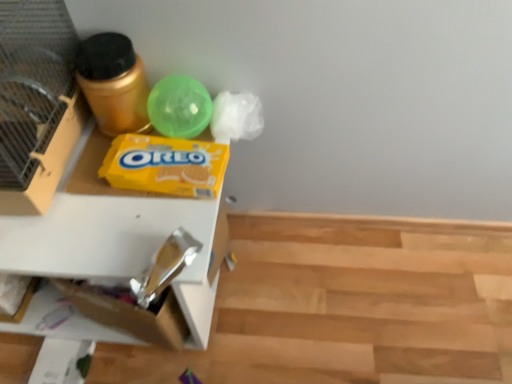
Identify the location of wooden floor at lower right. (345, 305).

The image size is (512, 384). In order to click on brushed metal bird cage at left in this screenshot , I will do `click(36, 102)`.

Does point (135, 212) lie in front of point (6, 0)?

No, it is not.

From the image's perspective, is white cardboard drawer at left over brushed metal bird cage at left?

No.

How distant is white cardboard drawer at left from brushed metal bird cage at left?

white cardboard drawer at left is 6.67 inches away from brushed metal bird cage at left.

Considering the relative sizes of white cardboard drawer at left and brushed metal bird cage at left in the image provided, is white cardboard drawer at left wider than brushed metal bird cage at left?

Yes.

Which object is further away from the camera taking this photo, gold metallic canister at upper left or white cardboard drawer at left?

gold metallic canister at upper left is more distant.

Does gold metallic canister at upper left have a greater height compared to white cardboard drawer at left?

In fact, gold metallic canister at upper left may be shorter than white cardboard drawer at left.

Is there a large distance between gold metallic canister at upper left and white cardboard drawer at left?

No.

The width and height of the screenshot is (512, 384). What are the coordinates of `table on the left of gold metallic canister at upper left` in the screenshot? It's located at (121, 244).

Is gold metallic canister at upper left looking in the opposite direction of brushed metal bird cage at left?

No, gold metallic canister at upper left is not facing away from brushed metal bird cage at left.

Based on the photo, considering the relative sizes of gold metallic canister at upper left and brushed metal bird cage at left in the image provided, is gold metallic canister at upper left wider than brushed metal bird cage at left?

No, gold metallic canister at upper left is not wider than brushed metal bird cage at left.

Based on the photo, can you confirm if gold metallic canister at upper left is positioned to the right of brushed metal bird cage at left?

Indeed, gold metallic canister at upper left is positioned on the right side of brushed metal bird cage at left.

In the scene shown: Considering the relative sizes of translucent green ball at upper center and wooden floor at lower right in the image provided, is translucent green ball at upper center shorter than wooden floor at lower right?

No, translucent green ball at upper center is not shorter than wooden floor at lower right.

Who is more distant, translucent green ball at upper center or wooden floor at lower right?

wooden floor at lower right.

Does translucent green ball at upper center turn towards wooden floor at lower right?

No, translucent green ball at upper center is not facing towards wooden floor at lower right.

Choose the correct answer: Is translucent green ball at upper center inside wooden floor at lower right or outside it?

translucent green ball at upper center lies outside wooden floor at lower right.

In the scene shown: Which of these two, yellow cardboard oreo box at center or brushed metal bird cage at left, stands shorter?

With less height is yellow cardboard oreo box at center.

Does yellow cardboard oreo box at center come behind brushed metal bird cage at left?

Yes, yellow cardboard oreo box at center is further from the camera.

Is yellow cardboard oreo box at center bigger than brushed metal bird cage at left?

No.

From the image's perspective, between wooden floor at lower right and translucent green ball at upper center, who is located below?

wooden floor at lower right, from the image's perspective.

Does point (302, 340) lie behind point (200, 88)?

Yes, it is behind point (200, 88).

Is brushed metal bird cage at left far away from wooden floor at lower right?

That's not correct — brushed metal bird cage at left is a little close to wooden floor at lower right.

From a real-world perspective, which object rests below the other?

wooden floor at lower right.

Looking at this image, from the image's perspective, is brushed metal bird cage at left above or below wooden floor at lower right?

From the image's perspective, brushed metal bird cage at left appears above wooden floor at lower right.

What's the angular difference between brushed metal bird cage at left and wooden floor at lower right's facing directions?

The angular difference between brushed metal bird cage at left and wooden floor at lower right is 90.9 degrees.

Locate an element on the screen. Image resolution: width=512 pixels, height=384 pixels. bird cage above the white cardboard drawer at left (from the image's perspective) is located at coordinates (36, 102).

Find the location of a particular element. This screenshot has height=384, width=512. table located below the gold metallic canister at upper left (from the image's perspective) is located at coordinates (121, 244).

Estimate the real-world distances between objects in this image. Which object is further from wooden floor at lower right, translucent green ball at upper center or yellow cardboard oreo box at center?

translucent green ball at upper center is further to wooden floor at lower right.

Based on their spatial positions, is wooden floor at lower right or translucent green ball at upper center closer to yellow cardboard oreo box at center?

translucent green ball at upper center lies closer to yellow cardboard oreo box at center than the other object.

Which object lies further to the anchor point brushed metal bird cage at left, wooden floor at lower right or translucent green ball at upper center?

wooden floor at lower right is positioned further to the anchor brushed metal bird cage at left.

Considering their positions, is yellow cardboard oreo box at center positioned closer to gold metallic canister at upper left than white cardboard drawer at left?

yellow cardboard oreo box at center is closer to gold metallic canister at upper left.

Considering their positions, is brushed metal bird cage at left positioned further to white cardboard drawer at left than yellow cardboard oreo box at center?

brushed metal bird cage at left.

Considering their positions, is yellow cardboard oreo box at center positioned closer to brushed metal bird cage at left than wooden floor at lower right?

yellow cardboard oreo box at center is positioned closer to the anchor brushed metal bird cage at left.

Based on their spatial positions, is translucent green ball at upper center or brushed metal bird cage at left closer to white cardboard drawer at left?

Among the two, brushed metal bird cage at left is located nearer to white cardboard drawer at left.

Considering their positions, is wooden floor at lower right positioned further to gold metallic canister at upper left than brushed metal bird cage at left?

wooden floor at lower right.

You are a GUI agent. You are given a task and a screenshot of the screen. Output one action in this format:
    pyautogui.click(x=<x>, y=<y>)
    Task: Click on the table between brushed metal bird cage at left and yellow cardboard oreo box at center
    The width and height of the screenshot is (512, 384).
    Given the screenshot: What is the action you would take?
    pyautogui.click(x=121, y=244)

At what (x,y) coordinates should I click in order to perform the action: click on table located between brushed metal bird cage at left and translucent green ball at upper center in the left-right direction. Please return your answer as a coordinate pair (x, y). Looking at the image, I should click on (121, 244).

In order to click on toy between gold metallic canister at upper left and white cardboard drawer at left from top to bottom in this screenshot , I will do `click(179, 107)`.

This screenshot has width=512, height=384. Find the location of `waste located between brushed metal bird cage at left and wooden floor at lower right in the left-right direction`. waste located between brushed metal bird cage at left and wooden floor at lower right in the left-right direction is located at coordinates (165, 165).